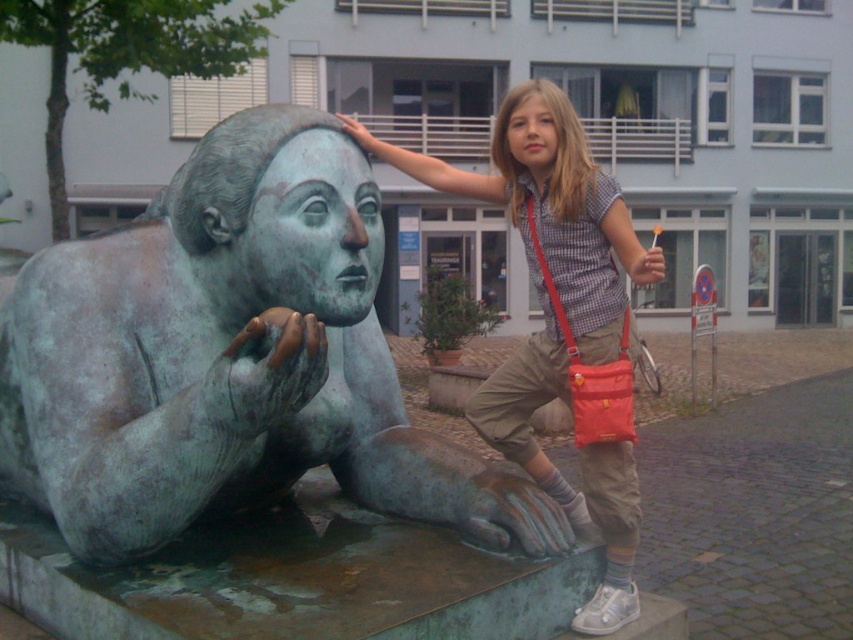
Question: From the image, what is the correct spatial relationship of green patina statue at center in relation to matte bronze statue at center?

Choices:
 (A) right
 (B) left

Answer: (B)

Question: Does green patina statue at center appear over matte bronze statue at center?

Choices:
 (A) no
 (B) yes

Answer: (A)

Question: Which point is farther to the camera?

Choices:
 (A) matte bronze statue at center
 (B) green patina statue at center

Answer: (A)

Question: Is green patina statue at center above matte bronze statue at center?

Choices:
 (A) no
 (B) yes

Answer: (A)